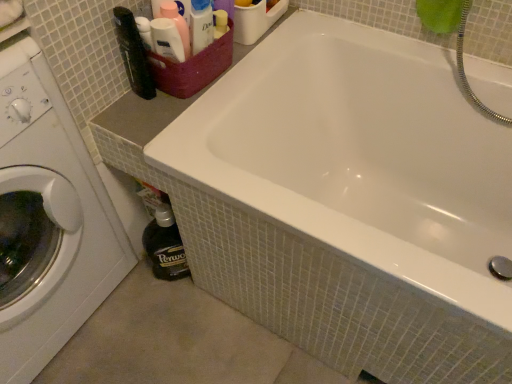
The image size is (512, 384). Describe the element at coordinates (193, 68) in the screenshot. I see `maroon woven basket at upper left` at that location.

Where is `maroon woven basket at upper left`? This screenshot has width=512, height=384. maroon woven basket at upper left is located at coordinates (193, 68).

Locate an element on the screen. This screenshot has height=384, width=512. white glossy bathtub at upper center is located at coordinates (358, 155).

The height and width of the screenshot is (384, 512). What do you see at coordinates (48, 220) in the screenshot?
I see `white glossy washing machine at left` at bounding box center [48, 220].

At what (x,y) coordinates should I click in order to perform the action: click on maroon woven basket at upper left. Please return your answer as a coordinate pair (x, y). This screenshot has width=512, height=384. Looking at the image, I should click on (193, 68).

Who is bigger, white glossy bathtub at upper center or white glossy washing machine at left?

white glossy bathtub at upper center is bigger.

Which of these two, white glossy bathtub at upper center or white glossy washing machine at left, stands taller?

Standing taller between the two is white glossy washing machine at left.

In terms of width, does white glossy bathtub at upper center look wider or thinner when compared to white glossy washing machine at left?

Considering their sizes, white glossy bathtub at upper center looks broader than white glossy washing machine at left.

Does point (204, 86) come behind point (342, 52)?

That is False.

Identify the location of bathtub below the maroon woven basket at upper left (from the image's perspective). pyautogui.click(x=358, y=155).

Considering the sizes of maroon woven basket at upper left and white glossy bathtub at upper center in the image, is maroon woven basket at upper left wider or thinner than white glossy bathtub at upper center?

maroon woven basket at upper left is thinner than white glossy bathtub at upper center.

Could maroon woven basket at upper left be considered to be inside white glossy washing machine at left?

Actually, maroon woven basket at upper left is outside white glossy washing machine at left.

Consider the image. Is white glossy washing machine at left positioned before maroon woven basket at upper left?

Yes, white glossy washing machine at left is in front of maroon woven basket at upper left.

From a real-world perspective, is white glossy washing machine at left positioned above or below maroon woven basket at upper left?

white glossy washing machine at left is below maroon woven basket at upper left.

Which of these two, maroon woven basket at upper left or white glossy washing machine at left, is bigger?

With larger size is white glossy washing machine at left.

From the image's perspective, between maroon woven basket at upper left and white glossy washing machine at left, which one is located above?

maroon woven basket at upper left is shown above in the image.

Would you say maroon woven basket at upper left is a long distance from white glossy washing machine at left?

maroon woven basket at upper left is actually quite close to white glossy washing machine at left.

In terms of width, does maroon woven basket at upper left look wider or thinner when compared to white glossy washing machine at left?

maroon woven basket at upper left is thinner than white glossy washing machine at left.

Is white glossy washing machine at left spatially inside white glossy bathtub at upper center, or outside of it?

white glossy washing machine at left is outside white glossy bathtub at upper center.

Considering the positions of point (64, 128) and point (468, 178), is point (64, 128) closer or farther from the camera than point (468, 178)?

Point (64, 128) appears to be closer to the viewer than point (468, 178).

Would you say white glossy washing machine at left is a long distance from white glossy bathtub at upper center?

That's not correct — white glossy washing machine at left is a little close to white glossy bathtub at upper center.

From a real-world perspective, is white glossy bathtub at upper center located beneath maroon woven basket at upper left?

Yes, from a real-world perspective, white glossy bathtub at upper center is below maroon woven basket at upper left.

Which is closer to the camera, [475,111] or [209,81]?

Point [475,111].

Find the location of a particular element. The width and height of the screenshot is (512, 384). bathtub below the maroon woven basket at upper left (from the image's perspective) is located at coordinates (358, 155).

Between white glossy bathtub at upper center and maroon woven basket at upper left, which one appears on the left side from the viewer's perspective?

Positioned to the left is maroon woven basket at upper left.

Where is `washing machine below the white glossy bathtub at upper center (from the image's perspective)`? This screenshot has width=512, height=384. washing machine below the white glossy bathtub at upper center (from the image's perspective) is located at coordinates (48, 220).

At what (x,y) coordinates should I click in order to perform the action: click on basket that appears behind the white glossy bathtub at upper center. Please return your answer as a coordinate pair (x, y). This screenshot has width=512, height=384. Looking at the image, I should click on (193, 68).

Estimate the real-world distances between objects in this image. Which object is further from white glossy bathtub at upper center, maroon woven basket at upper left or white glossy washing machine at left?

The object further to white glossy bathtub at upper center is white glossy washing machine at left.

When comparing their distances from white glossy washing machine at left, does white glossy bathtub at upper center or maroon woven basket at upper left seem closer?

Based on the image, maroon woven basket at upper left appears to be nearer to white glossy washing machine at left.

Based on their spatial positions, is white glossy washing machine at left or white glossy bathtub at upper center closer to maroon woven basket at upper left?

white glossy bathtub at upper center lies closer to maroon woven basket at upper left than the other object.

Which object lies further to the anchor point white glossy washing machine at left, maroon woven basket at upper left or white glossy bathtub at upper center?

white glossy bathtub at upper center is further to white glossy washing machine at left.

When comparing their distances from maroon woven basket at upper left, does white glossy bathtub at upper center or white glossy washing machine at left seem further?

Based on the image, white glossy washing machine at left appears to be further to maroon woven basket at upper left.

Based on their spatial positions, is white glossy washing machine at left or maroon woven basket at upper left closer to white glossy bathtub at upper center?

maroon woven basket at upper left lies closer to white glossy bathtub at upper center than the other object.

Find the location of a particular element. This screenshot has height=384, width=512. basket between white glossy washing machine at left and white glossy bathtub at upper center from left to right is located at coordinates (193, 68).